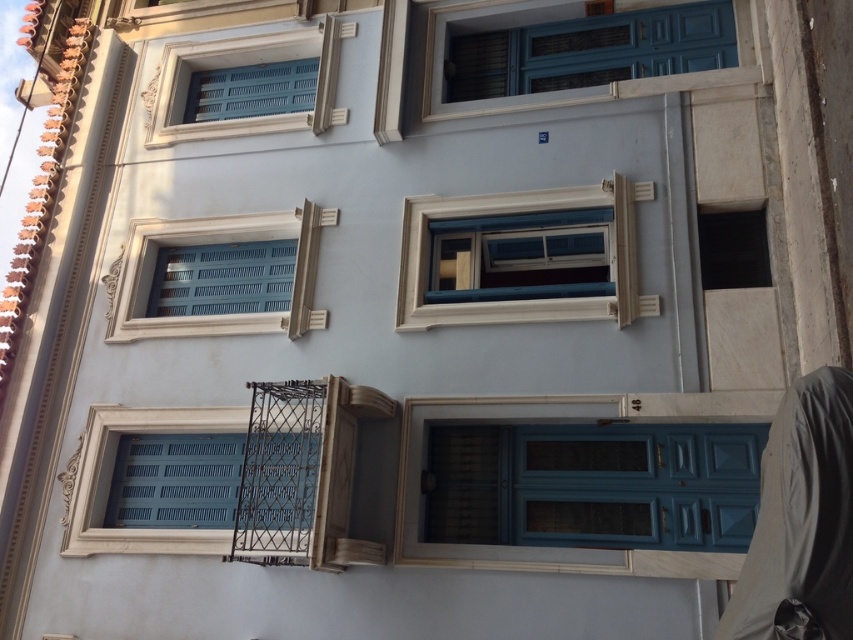
You are a painter standing in front of the building. You need to paint the matte white frame at center and the white painted wood window at upper left. Which object should you paint first if you want to start with the one that is further to the right?

The white painted wood window at upper left should be painted first because the matte white frame at center is to the left of it, meaning the window is further to the right.

You are standing at the point closer to the door. Which point are you at, point (706, 403) or point (242, 113)?

You are at point (706, 403) because it is in front of point (242, 113), meaning it is closer to the door.

You are a painter who needs to decide which tool to use. You have a ladder and a step stool. The matte white frame at center is taller than the white painted wood window at upper left. Which object requires the taller tool to reach?

The matte white frame at center requires the taller tool to reach because it is taller than the white painted wood window at upper left.